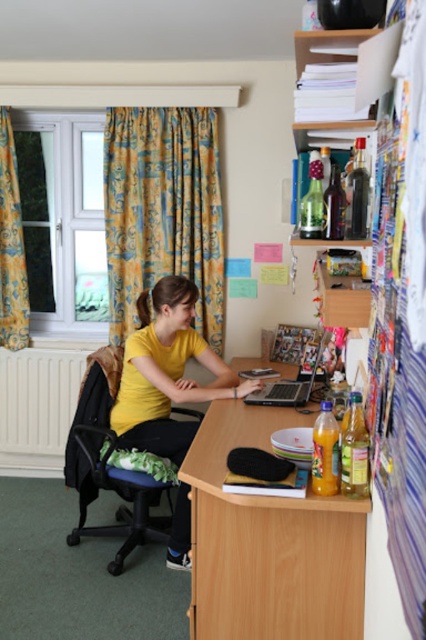
Which is in front, point (187, 268) or point (16, 257)?

Point (187, 268) is more forward.

Identify the location of yellow patterned curtain at upper left. (163, 211).

Between yellow matte shirt at center and yellow patterned curtain at left, which one has less height?

yellow matte shirt at center

Can you confirm if yellow matte shirt at center is positioned below yellow patterned curtain at left?

Yes.

Which is in front, point (141, 432) or point (20, 260)?

Point (141, 432) is in front.

The width and height of the screenshot is (426, 640). I want to click on yellow matte shirt at center, so click(166, 372).

Between wooden at center and yellow matte shirt at center, which one has less height?

Standing shorter between the two is wooden at center.

Can you confirm if wooden at center is shorter than yellow matte shirt at center?

Yes, wooden at center is shorter than yellow matte shirt at center.

Is point (244, 624) farther from camera compared to point (129, 371)?

No, (244, 624) is closer to viewer.

The image size is (426, 640). Identify the location of wooden at center. (268, 541).